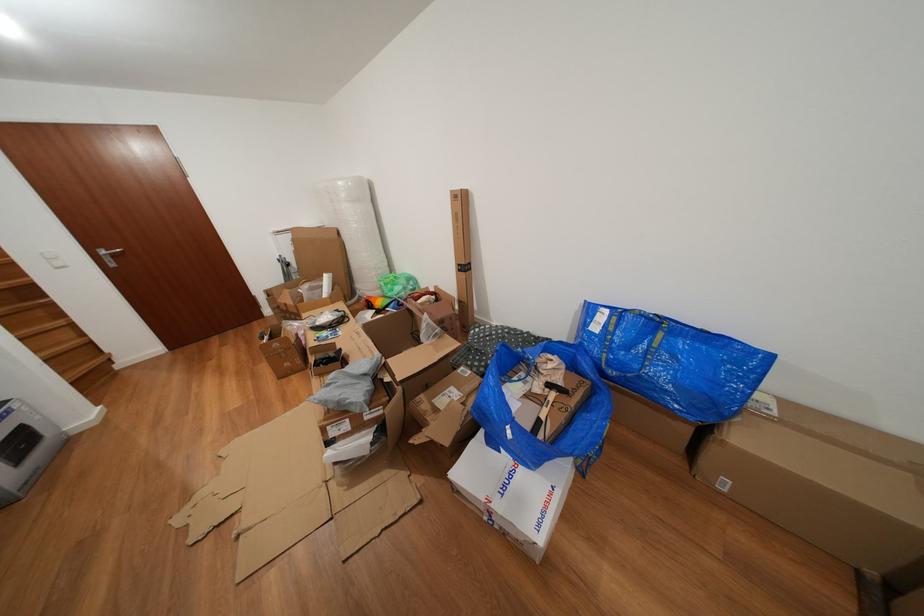
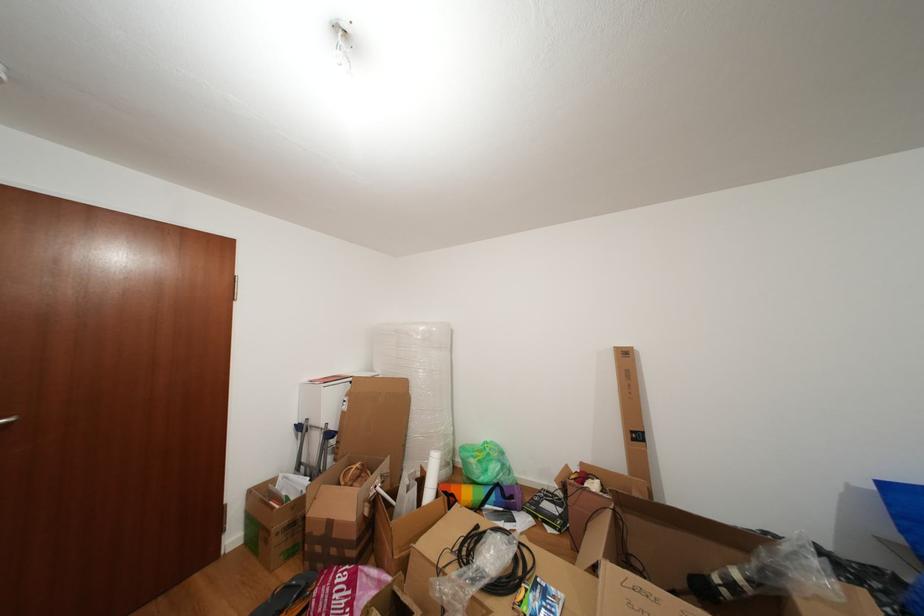
In the second image, find the point that corresponds to [399,294] in the first image.

(494, 476)